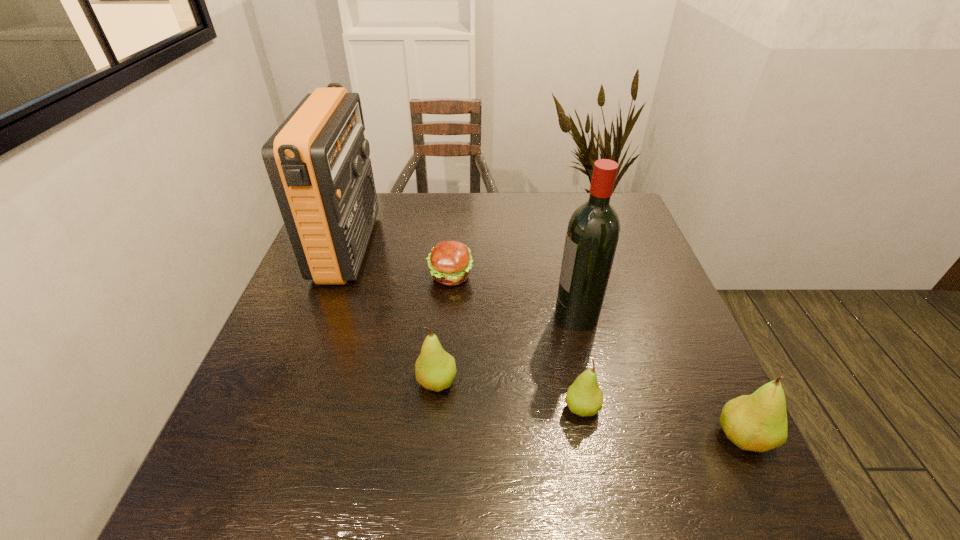
This screenshot has width=960, height=540. I want to click on the leftmost pear, so click(435, 369).

You are a GUI agent. You are given a task and a screenshot of the screen. Output one action in this format:
    pyautogui.click(x=<x>, y=<y>)
    Task: Click on the third shortest object
    The image size is (960, 540).
    Given the screenshot: What is the action you would take?
    tap(435, 369)

You are a GUI agent. You are given a task and a screenshot of the screen. Output one action in this format:
    pyautogui.click(x=<x>, y=<y>)
    Task: Click on the second pear from right to left
    This screenshot has width=960, height=540.
    Given the screenshot: What is the action you would take?
    pyautogui.click(x=584, y=397)

Where is `the second shortest object`? The image size is (960, 540). the second shortest object is located at coordinates (584, 397).

You are a GUI agent. You are given a task and a screenshot of the screen. Output one action in this format:
    pyautogui.click(x=<x>, y=<y>)
    Task: Click on the rightmost object
    The height and width of the screenshot is (540, 960).
    Given the screenshot: What is the action you would take?
    pyautogui.click(x=757, y=422)

The image size is (960, 540). Identify the location of hamburger. (450, 262).

Identify the location of radio receiver. Image resolution: width=960 pixels, height=540 pixels. (317, 161).

You are a GUI agent. You are given a task and a screenshot of the screen. Output one action in this format:
    pyautogui.click(x=<x>, y=<y>)
    Task: Click on the third farthest object
    
    Given the screenshot: What is the action you would take?
    pyautogui.click(x=593, y=230)

Find the location of a particular element. free spot located 0.300m on the left of the fourth tallest object is located at coordinates [272, 382].

Find the location of `vacant space located 0.050m on the front of the second shortest object`. vacant space located 0.050m on the front of the second shortest object is located at coordinates [589, 449].